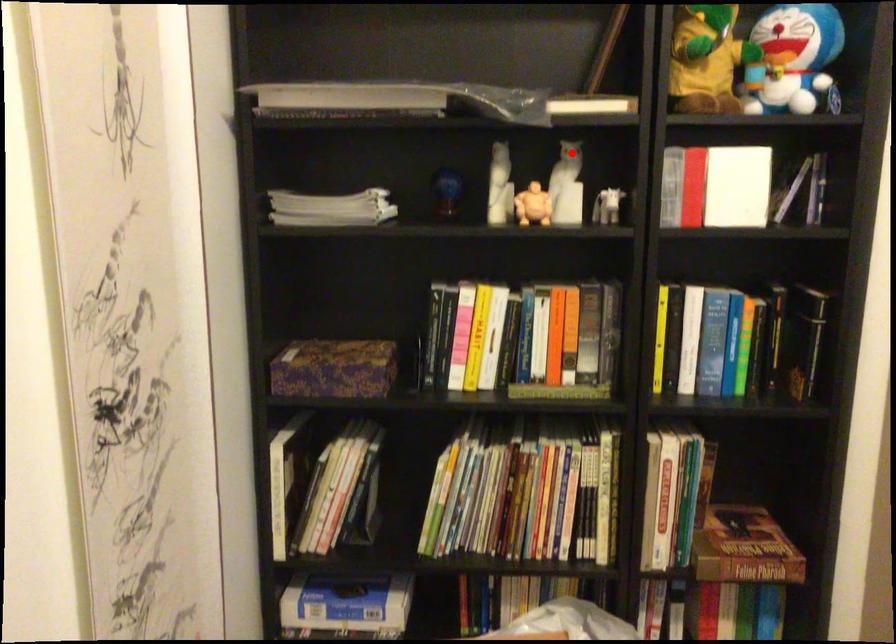
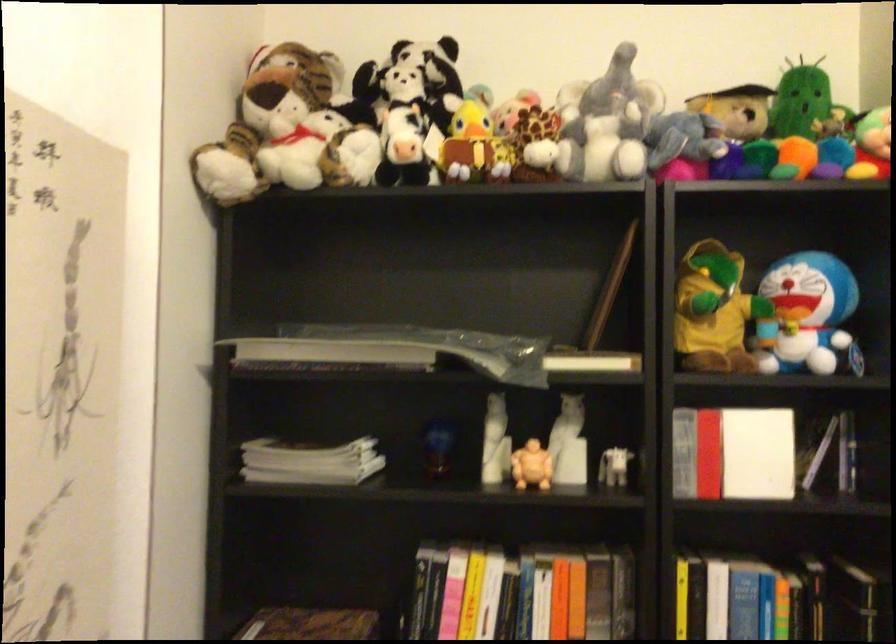
Question: I am providing you with two images of the same scene from different viewpoints. A red point is marked on the first image. Is the red point's position out of view in image 2?

Choices:
 (A) Yes
 (B) No

Answer: (B)